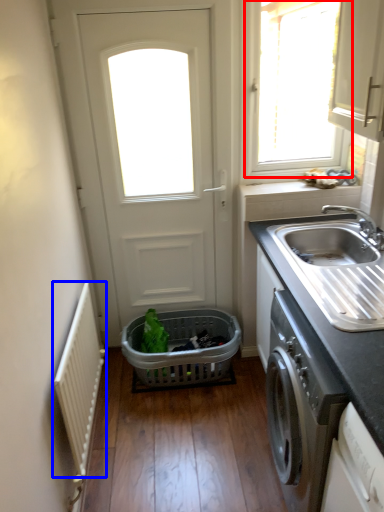
Question: Among these objects, which one is nearest to the camera, window (highlighted by a red box) or radiator (highlighted by a blue box)?

Choices:
 (A) window
 (B) radiator

Answer: (B)